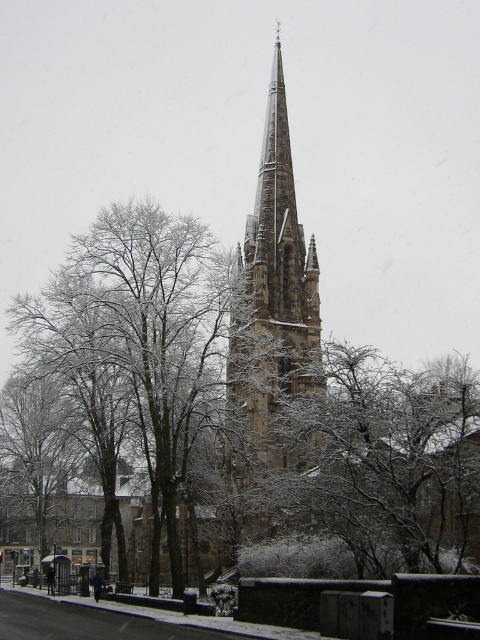
Who is taller, snow-covered branches at center or brown stone tower at center?

Standing taller between the two is brown stone tower at center.

Is point (387, 488) more distant than point (320, 337)?

No, (387, 488) is closer to viewer.

Find the location of `snow-covered branches at center`. snow-covered branches at center is located at coordinates (377, 470).

Who is lower down, snow-covered branches at center or snow-covered tree at center?

snow-covered branches at center is lower down.

Is snow-covered branches at center taller than snow-covered tree at center?

No.

Between point (330, 490) and point (146, 397), which one is positioned behind?

The point (146, 397) is more distant.

The image size is (480, 640). In order to click on snow-covered branches at center in this screenshot , I will do `click(377, 470)`.

How distant is snow-covered tree at center from brown stone tower at center?

The distance of snow-covered tree at center from brown stone tower at center is 42.54 feet.

Consider the image. Does snow-covered tree at center appear on the left side of brown stone tower at center?

Yes, snow-covered tree at center is to the left of brown stone tower at center.

Is point (108, 292) farther from camera compared to point (269, 344)?

Yes, it is behind point (269, 344).

Identify the location of snow-covered tree at center. This screenshot has height=640, width=480. (140, 336).